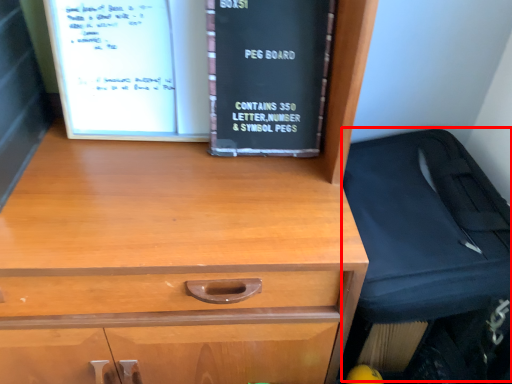
Question: From the image, what is the correct spatial relationship of luggage (annotated by the red box) in relation to book?

Choices:
 (A) right
 (B) left

Answer: (A)